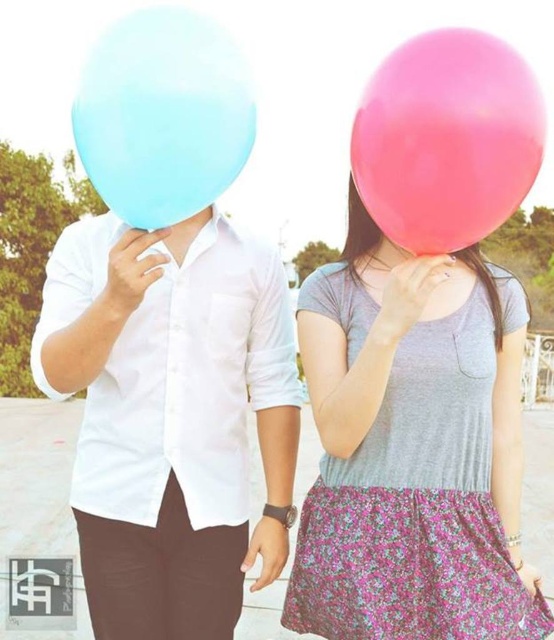
Can you confirm if white matte shirt at left is positioned above pink rubber balloon at upper right?

Incorrect, white matte shirt at left is not positioned above pink rubber balloon at upper right.

Does white matte shirt at left come behind pink rubber balloon at upper right?

Yes, it is behind pink rubber balloon at upper right.

Identify the location of white matte shirt at left. (171, 417).

Can you confirm if white matte shirt at left is positioned below matte pink balloon at center?

Correct, white matte shirt at left is located below matte pink balloon at center.

Does white matte shirt at left have a greater height compared to matte pink balloon at center?

Correct, white matte shirt at left is much taller as matte pink balloon at center.

Locate an element on the screen. white matte shirt at left is located at coordinates (171, 417).

Locate an element on the screen. white matte shirt at left is located at coordinates (171, 417).

Between point (283, 397) and point (188, 13), which one is positioned behind?

The point (283, 397) is behind.

Consider the image. Does white matte shirt at left come in front of matte blue balloon at upper left?

No.

Is point (71, 253) closer to camera compared to point (134, 115)?

No.

Where is `white matte shirt at left`? white matte shirt at left is located at coordinates (171, 417).